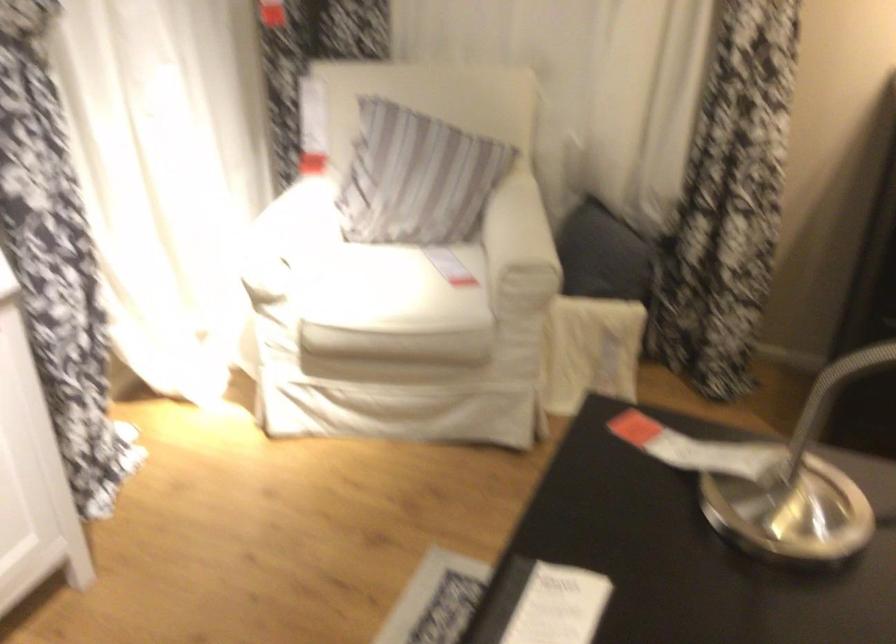
Locate an element on the screen. lamp flexible neck is located at coordinates (799, 486).